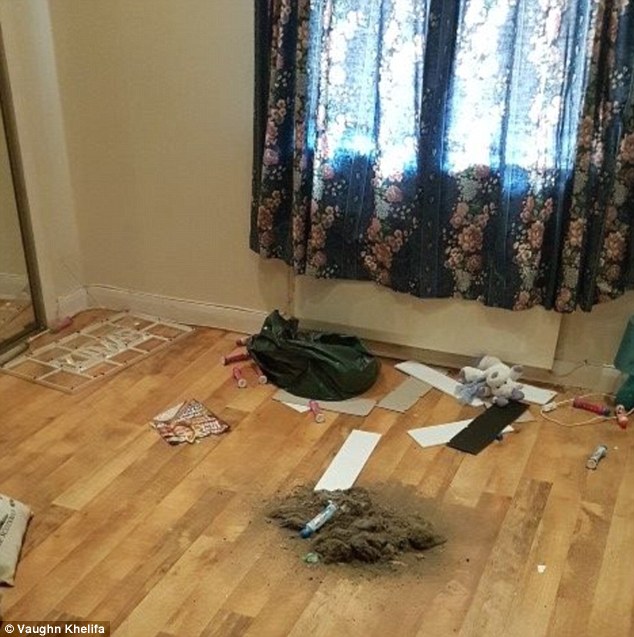
Find the location of a particular element. mirror is located at coordinates (25, 292).